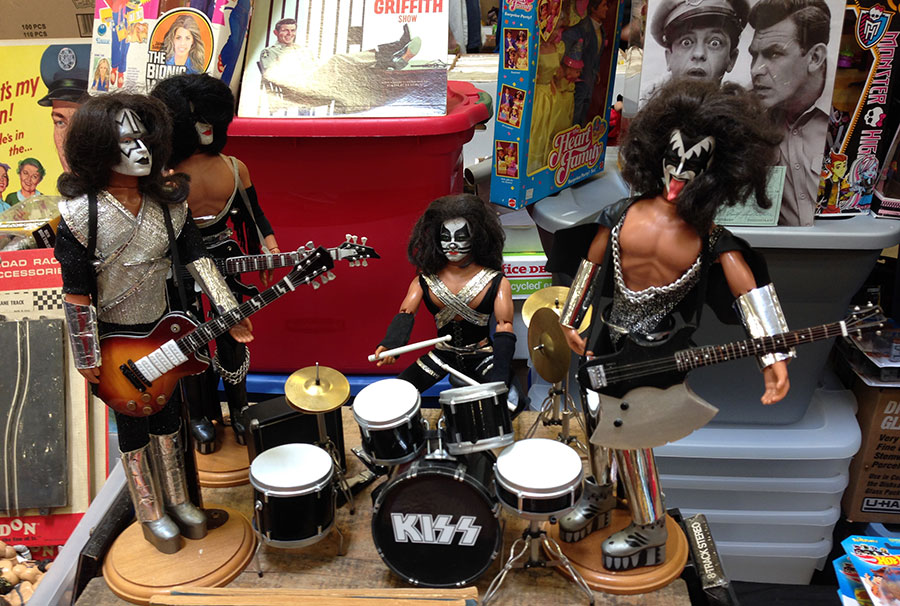
I want to click on toy figure, so click(673, 327).